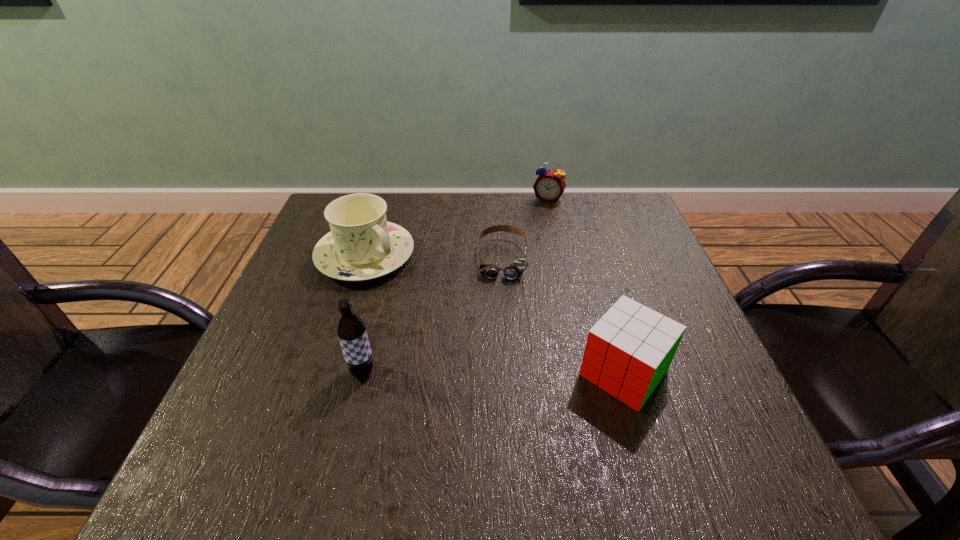
The image size is (960, 540). What are the coordinates of `unoccupied position between the third object from left to right and the tallest object` in the screenshot? It's located at (433, 315).

The height and width of the screenshot is (540, 960). In order to click on vacant region between the farthest object and the tallest object in this screenshot , I will do `click(455, 286)`.

Identify the location of unoccupied area between the third object from right to left and the chinaware. The image size is (960, 540). (434, 257).

At what (x,y) coordinates should I click in order to perform the action: click on vacant area that lies between the root beer and the cube. Please return your answer as a coordinate pair (x, y). The height and width of the screenshot is (540, 960). Looking at the image, I should click on (493, 372).

At what (x,y) coordinates should I click in order to perform the action: click on vacant space in between the farthest object and the tallest object. Please return your answer as a coordinate pair (x, y). This screenshot has height=540, width=960. Looking at the image, I should click on (455, 286).

Locate an element on the screen. The height and width of the screenshot is (540, 960). empty space that is in between the cube and the goggles is located at coordinates (564, 315).

Locate an element on the screen. The image size is (960, 540). empty space between the chinaware and the cube is located at coordinates (494, 314).

Where is `free area in between the shortest object and the chinaware`? free area in between the shortest object and the chinaware is located at coordinates (434, 257).

Locate an element on the screen. vacant space that is in between the root beer and the third object from right to left is located at coordinates (433, 315).

The image size is (960, 540). What are the coordinates of `vacant area between the cube and the third object from right to left` in the screenshot? It's located at (564, 315).